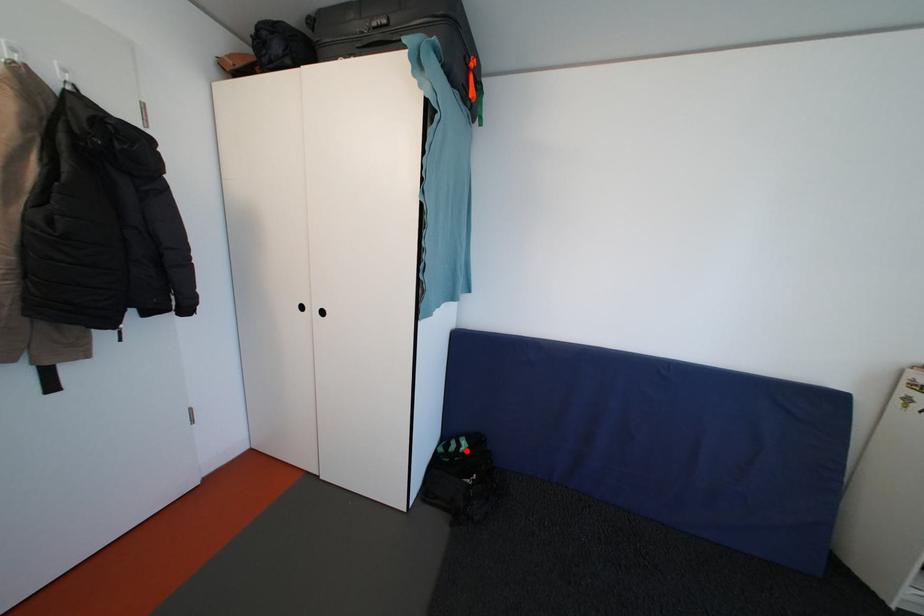
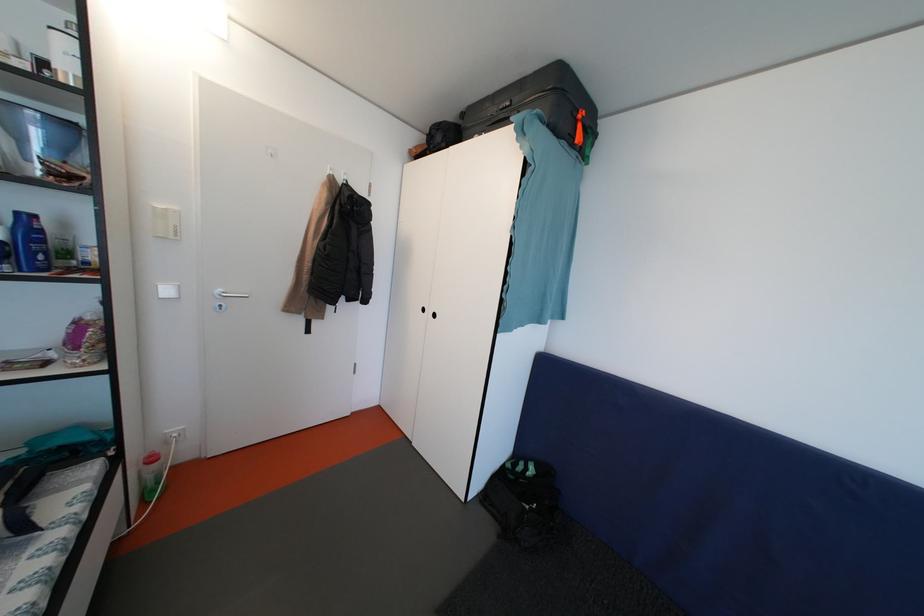
Question: I am providing you with two images of the same scene from different viewpoints. A red point is shown in image1. For the corresponding object point in image2, is it positioned nearer or farther from the camera?

Choices:
 (A) Nearer
 (B) Farther

Answer: (A)